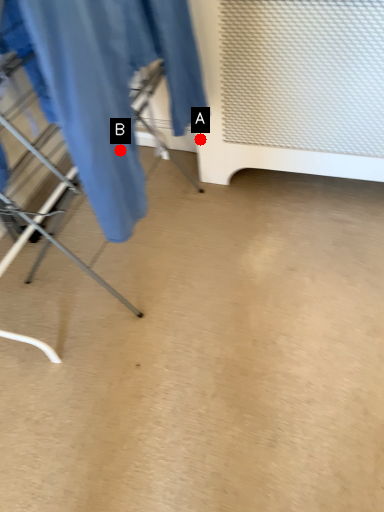
Question: Two points are circled on the image, labeled by A and B beside each circle. Which point is closer to the camera taking this photo?

Choices:
 (A) A is closer
 (B) B is closer

Answer: (B)